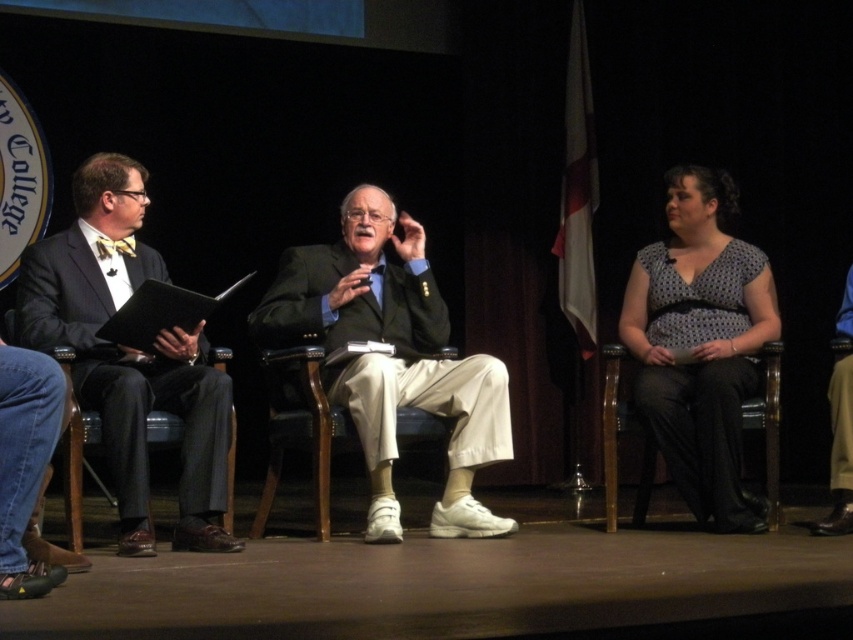
Question: Is wooden chair at center to the right of black fabric chair at right from the viewer's perspective?

Choices:
 (A) yes
 (B) no

Answer: (B)

Question: Considering the relative positions of polka dot fabric blouse at center and wooden chair at center in the image provided, where is polka dot fabric blouse at center located with respect to wooden chair at center?

Choices:
 (A) above
 (B) below

Answer: (A)

Question: Considering the real-world distances, which object is farthest from the polka dot fabric blouse at center?

Choices:
 (A) dark green suit at center
 (B) matte black suit at left
 (C) black fabric chair at right
 (D) wooden chair at center

Answer: (B)

Question: Considering the real-world distances, which object is closest to the matte black suit at left?

Choices:
 (A) wooden chair at center
 (B) dark green suit at center
 (C) black fabric chair at right
 (D) polka dot fabric blouse at center

Answer: (A)

Question: Can you confirm if polka dot fabric blouse at center is bigger than black fabric chair at right?

Choices:
 (A) yes
 (B) no

Answer: (A)

Question: Which object is the farthest from the dark green suit at center?

Choices:
 (A) wooden chair at center
 (B) black fabric chair at right
 (C) polka dot fabric blouse at center

Answer: (C)